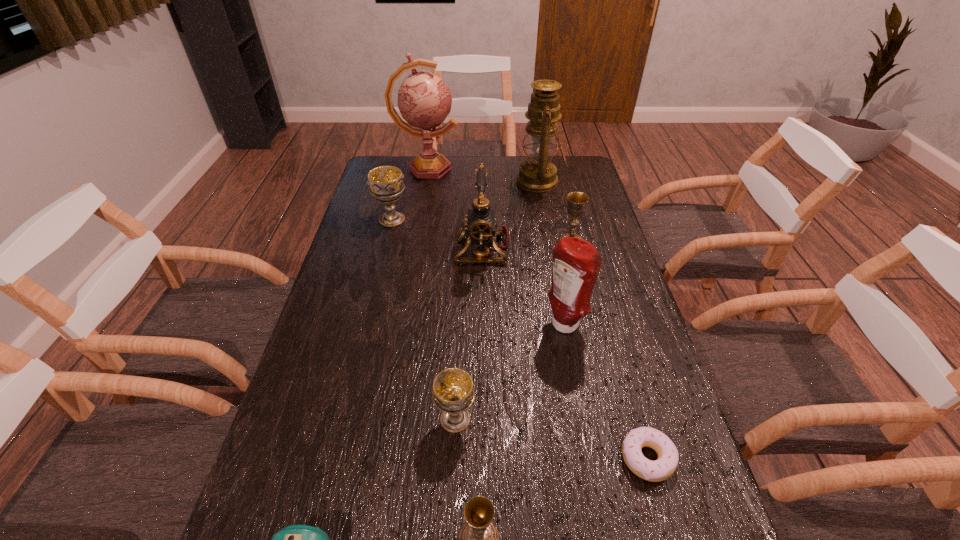
Find the location of `pink globe`. pink globe is located at coordinates (424, 100).

Find the location of a particular element. This screenshot has height=540, width=960. oil lamp is located at coordinates (537, 174).

The image size is (960, 540). In order to click on condiment in this screenshot , I will do `click(576, 262)`.

I want to click on red condiment, so click(x=576, y=262).

Locate an element on the screen. This screenshot has width=960, height=540. telephone is located at coordinates (481, 228).

This screenshot has height=540, width=960. Identify the location of the second farthest chalice. (577, 201).

Find the location of a particular element. the right gold chalice is located at coordinates (577, 201).

Find the location of a particular element. the leftmost chalice is located at coordinates (385, 183).

The width and height of the screenshot is (960, 540). Find the location of `the bigger white chalice`. the bigger white chalice is located at coordinates (385, 183).

Find the location of a particular element. The image size is (960, 540). the right white chalice is located at coordinates (453, 393).